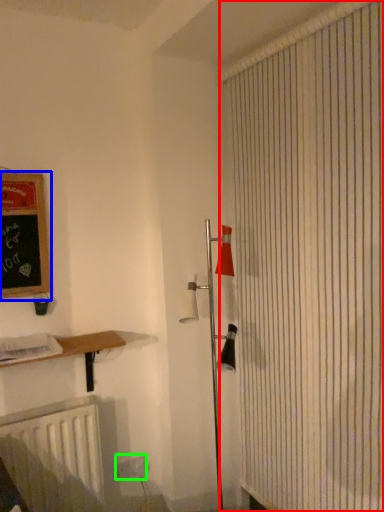
Question: Based on their relative distances, which object is nearer to shower curtain (highlighted by a red box)? Choose from bulletin board (highlighted by a blue box) and electric outlet (highlighted by a green box).

Choices:
 (A) bulletin board
 (B) electric outlet

Answer: (A)